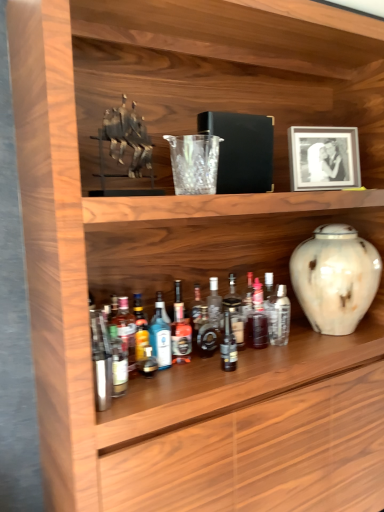
Based on the photo, how much space does clear glass bottle at center, positioned as the first bottle in right-to-left order, occupy horizontally?

clear glass bottle at center, positioned as the first bottle in right-to-left order, is 3.73 inches wide.

In order to click on white marbled vase at right in this screenshot , I will do `click(335, 278)`.

This screenshot has height=512, width=384. Find the location of `blue glass bottle at center, the sixth bottle when ordered from right to left`. blue glass bottle at center, the sixth bottle when ordered from right to left is located at coordinates (160, 338).

Describe the element at coordinates (228, 346) in the screenshot. I see `matte glass bottle at center, the 5th bottle in the left-to-right sequence` at that location.

Find the location of a particular element. black matte picture frame at upper right is located at coordinates (323, 158).

The image size is (384, 512). Describe the element at coordinates (323, 158) in the screenshot. I see `black matte picture frame at upper right` at that location.

What are the coordinates of `translucent glass bottle at center, the sixth bottle when ordered from left to right` in the screenshot? It's located at (257, 319).

What do you see at coordinates (257, 319) in the screenshot?
I see `translucent glass bottle at center, placed as the 2th bottle when sorted from right to left` at bounding box center [257, 319].

Image resolution: width=384 pixels, height=512 pixels. Find the location of `clear glass bottle at center, acting as the seventh bottle starting from the left`. clear glass bottle at center, acting as the seventh bottle starting from the left is located at coordinates (279, 316).

Between clear glass bottle at center, positioned as the first bottle in right-to-left order, and black matte picture frame at upper right, which one is positioned behind?

clear glass bottle at center, positioned as the first bottle in right-to-left order, is further from the camera.

Which of these two, clear glass bottle at center, positioned as the first bottle in right-to-left order, or black matte picture frame at upper right, stands shorter?

clear glass bottle at center, positioned as the first bottle in right-to-left order, is shorter.

Does point (278, 333) come closer to viewer compared to point (316, 132)?

Yes, point (278, 333) is in front of point (316, 132).

Can black matte picture frame at upper right be found inside clear glass bottle at center, acting as the seventh bottle starting from the left?

No, black matte picture frame at upper right is not inside clear glass bottle at center, acting as the seventh bottle starting from the left.

I want to click on bottle that is the 5th object to the left of the black matte picture frame at upper right, starting at the anchor, so click(x=180, y=330).

From the picture: Which object is positioned more to the right, translucent glass bottle at center, placed as the 5th bottle when sorted from right to left, or black matte picture frame at upper right?

Positioned to the right is black matte picture frame at upper right.

Could you tell me if translucent glass bottle at center, placed as the 5th bottle when sorted from right to left, is facing black matte picture frame at upper right?

No, translucent glass bottle at center, placed as the 5th bottle when sorted from right to left, does not turn towards black matte picture frame at upper right.

Between translucent glass bottle at center, placed as the 5th bottle when sorted from right to left, and black matte picture frame at upper right, which one has larger size?

black matte picture frame at upper right is bigger.

Which is closer to the camera, (254, 308) or (224, 353)?

The point (224, 353) is more forward.

Can you tell me how much translucent glass bottle at center, the sixth bottle when ordered from left to right, and matte glass bottle at center, the 3th bottle when ordered from right to left, differ in facing direction?

The angular difference between translucent glass bottle at center, the sixth bottle when ordered from left to right, and matte glass bottle at center, the 3th bottle when ordered from right to left, is 3.09 degrees.

From the picture: Looking at the image, does translucent glass bottle at center, placed as the 2th bottle when sorted from right to left, seem bigger or smaller compared to matte glass bottle at center, the 5th bottle in the left-to-right sequence?

Considering their sizes, translucent glass bottle at center, placed as the 2th bottle when sorted from right to left, takes up more space than matte glass bottle at center, the 5th bottle in the left-to-right sequence.

Find the location of a particular element. This screenshot has width=384, height=512. the 5th bottle below the translucent glass bottle at center, placed as the 2th bottle when sorted from right to left (from the image's perspective) is located at coordinates (228, 346).

Between matte glass bottle at center, the 5th bottle in the left-to-right sequence, and shiny dark glass bottle at center, which is the fourth bottle from right to left, which one has smaller size?

Smaller between the two is matte glass bottle at center, the 5th bottle in the left-to-right sequence.

Is matte glass bottle at center, the 3th bottle when ordered from right to left, facing away from shiny dark glass bottle at center, which is the fourth bottle from right to left?

Yes, matte glass bottle at center, the 3th bottle when ordered from right to left, is facing away from shiny dark glass bottle at center, which is the fourth bottle from right to left.

There is a matte glass bottle at center, the 3th bottle when ordered from right to left. In order to click on the 1st bottle below it (from a real-world perspective) in this screenshot , I will do [x=207, y=333].

Which is behind, shiny dark glass bottle at center, the 4th bottle positioned from the left, or translucent glass bottle at center, placed as the 2th bottle when sorted from right to left?

translucent glass bottle at center, placed as the 2th bottle when sorted from right to left, is behind.

Choose the correct answer: Is shiny dark glass bottle at center, which is the fourth bottle from right to left, inside translucent glass bottle at center, placed as the 2th bottle when sorted from right to left, or outside it?

shiny dark glass bottle at center, which is the fourth bottle from right to left, is located beyond the bounds of translucent glass bottle at center, placed as the 2th bottle when sorted from right to left.

From the image's perspective, which is above, shiny dark glass bottle at center, the 4th bottle positioned from the left, or translucent glass bottle at center, the sixth bottle when ordered from left to right?

translucent glass bottle at center, the sixth bottle when ordered from left to right, is shown above in the image.

Is shiny dark glass bottle at center, the 4th bottle positioned from the left, placed right next to translucent glass bottle at center, the sixth bottle when ordered from left to right?

No, shiny dark glass bottle at center, the 4th bottle positioned from the left, is not making contact with translucent glass bottle at center, the sixth bottle when ordered from left to right.

The image size is (384, 512). I want to click on the 4th bottle in front of the translucent glass bottle at center, placed as the 5th bottle when sorted from right to left, so click(125, 329).

From the image's perspective, which object appears higher, translucent glass bottle at center, the 1th bottle when ordered from left to right, or translucent glass bottle at center, placed as the 5th bottle when sorted from right to left?

translucent glass bottle at center, placed as the 5th bottle when sorted from right to left, from the image's perspective.

Which of these two, translucent glass bottle at center, which appears as the seventh bottle when viewed from the right, or translucent glass bottle at center, the 3th bottle in the left-to-right sequence, stands taller?

With more height is translucent glass bottle at center, which appears as the seventh bottle when viewed from the right.

Is blue glass bottle at center, the sixth bottle when ordered from right to left, further to camera compared to translucent glass bottle at center, the 1th bottle when ordered from left to right?

Yes, blue glass bottle at center, the sixth bottle when ordered from right to left, is further from the viewer.

Is blue glass bottle at center, the sixth bottle when ordered from right to left, taller than translucent glass bottle at center, the 1th bottle when ordered from left to right?

No.

Locate an element on the screen. Image resolution: width=384 pixels, height=512 pixels. the 2nd bottle above when counting from the blue glass bottle at center, which is the 2th bottle from left to right (from the image's perspective) is located at coordinates (125, 329).

How much distance is there between blue glass bottle at center, which is the 2th bottle from left to right, and translucent glass bottle at center, the 1th bottle when ordered from left to right?

A distance of 4.25 inches exists between blue glass bottle at center, which is the 2th bottle from left to right, and translucent glass bottle at center, the 1th bottle when ordered from left to right.

Where is `picture frame lying on the right of clear glass bottle at center, acting as the seventh bottle starting from the left`? Image resolution: width=384 pixels, height=512 pixels. picture frame lying on the right of clear glass bottle at center, acting as the seventh bottle starting from the left is located at coordinates (323, 158).

The image size is (384, 512). Identify the location of bottle that is the 1st one when counting backward from the black matte picture frame at upper right. (180, 330).

Which object lies further to the anchor point matte glass bottle at center, the 5th bottle in the left-to-right sequence, white marbled vase at right or blue glass bottle at center, the sixth bottle when ordered from right to left?

white marbled vase at right is further to matte glass bottle at center, the 5th bottle in the left-to-right sequence.

From the image, which object appears to be nearer to clear glass bottle at center, acting as the seventh bottle starting from the left, translucent glass bottle at center, placed as the 5th bottle when sorted from right to left, or translucent glass bottle at center, the sixth bottle when ordered from left to right?

Based on the image, translucent glass bottle at center, the sixth bottle when ordered from left to right, appears to be nearer to clear glass bottle at center, acting as the seventh bottle starting from the left.

When comparing their distances from translucent glass bottle at center, placed as the 2th bottle when sorted from right to left, does matte glass bottle at center, the 5th bottle in the left-to-right sequence, or translucent glass bottle at center, which appears as the seventh bottle when viewed from the right, seem further?

translucent glass bottle at center, which appears as the seventh bottle when viewed from the right, lies further to translucent glass bottle at center, placed as the 2th bottle when sorted from right to left, than the other object.

In the scene shown: Which object lies nearer to the anchor point blue glass bottle at center, the sixth bottle when ordered from right to left, black matte picture frame at upper right or translucent glass bottle at center, the 1th bottle when ordered from left to right?

translucent glass bottle at center, the 1th bottle when ordered from left to right, lies closer to blue glass bottle at center, the sixth bottle when ordered from right to left, than the other object.

Based on their spatial positions, is black matte picture frame at upper right or translucent glass bottle at center, the 1th bottle when ordered from left to right, further from clear glass bottle at center, acting as the seventh bottle starting from the left?

translucent glass bottle at center, the 1th bottle when ordered from left to right, lies further to clear glass bottle at center, acting as the seventh bottle starting from the left, than the other object.

Considering their positions, is translucent glass bottle at center, placed as the 2th bottle when sorted from right to left, positioned further to shiny dark glass bottle at center, the 4th bottle positioned from the left, than translucent glass bottle at center, placed as the 5th bottle when sorted from right to left?

translucent glass bottle at center, placed as the 2th bottle when sorted from right to left, lies further to shiny dark glass bottle at center, the 4th bottle positioned from the left, than the other object.

When comparing their distances from translucent glass bottle at center, which appears as the seventh bottle when viewed from the right, does shiny dark glass bottle at center, the 4th bottle positioned from the left, or white marbled vase at right seem further?

white marbled vase at right.

When comparing their distances from white marbled vase at right, does black matte picture frame at upper right or shiny dark glass bottle at center, the 4th bottle positioned from the left, seem closer?

black matte picture frame at upper right is closer to white marbled vase at right.

The image size is (384, 512). What are the coordinates of `picture frame located between translucent glass bottle at center, placed as the 5th bottle when sorted from right to left, and white marbled vase at right in the left-right direction` in the screenshot? It's located at (323, 158).

Where is `vase between black matte picture frame at upper right and shiny dark glass bottle at center, the 4th bottle positioned from the left, vertically`? This screenshot has width=384, height=512. vase between black matte picture frame at upper right and shiny dark glass bottle at center, the 4th bottle positioned from the left, vertically is located at coordinates (335, 278).

I want to click on vase between black matte picture frame at upper right and matte glass bottle at center, the 3th bottle when ordered from right to left, in the up-down direction, so click(335, 278).

Locate an element on the screen. The height and width of the screenshot is (512, 384). bottle situated between blue glass bottle at center, which is the 2th bottle from left to right, and shiny dark glass bottle at center, which is the fourth bottle from right to left, from left to right is located at coordinates (180, 330).